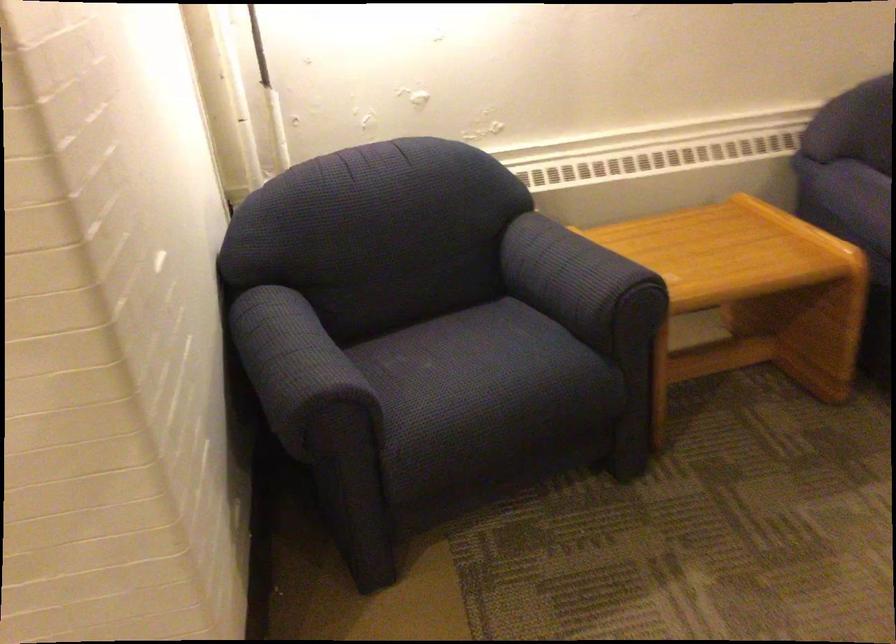
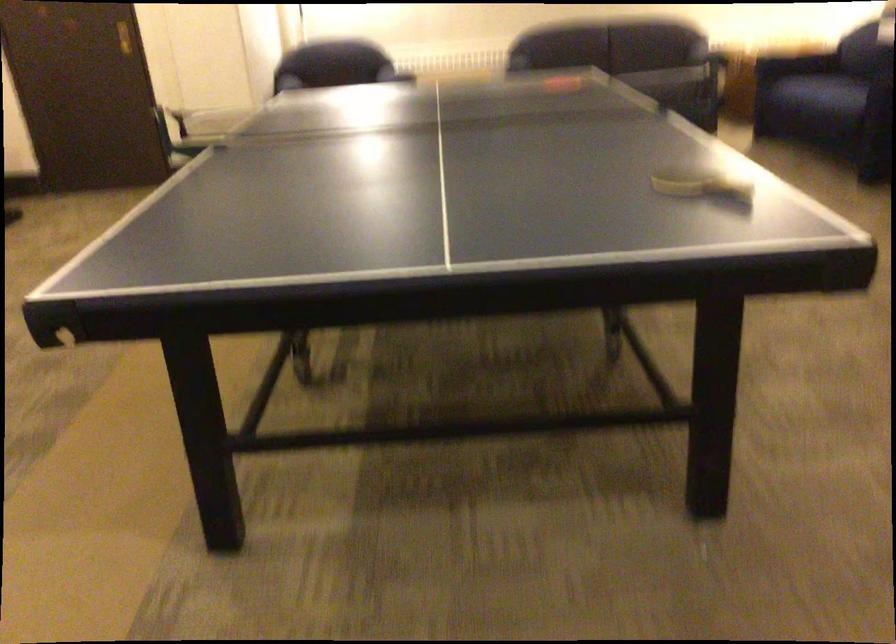
Question: I am providing you with two images of the same scene from different viewpoints. After the viewpoint changes to image2, which objects are now occluded?

Choices:
 (A) chair sitting surface
 (B) sofa sitting surface
 (C) blue chair armrest
 (D) small water bottle

Answer: (C)